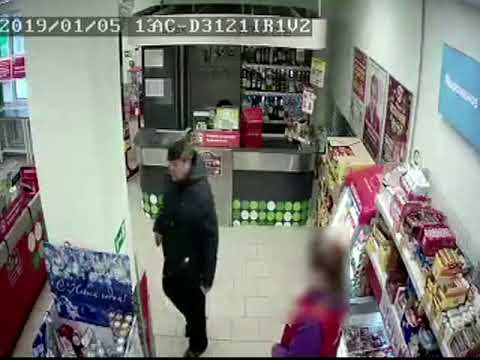
The image size is (480, 360). I want to click on stainless steel counter, so click(249, 161).